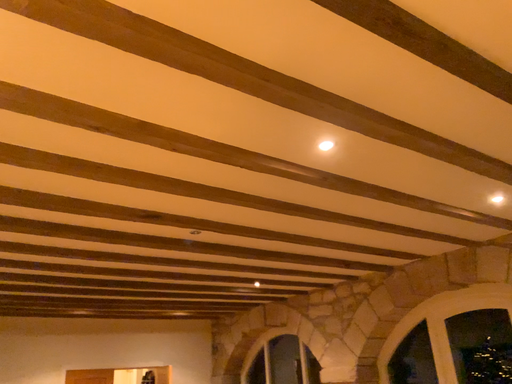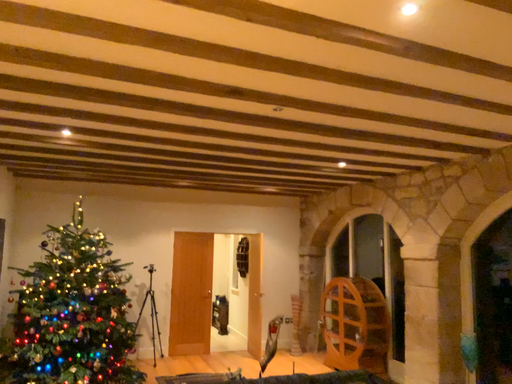
Question: Which way did the camera rotate in the video?

Choices:
 (A) rotated left
 (B) rotated right

Answer: (A)